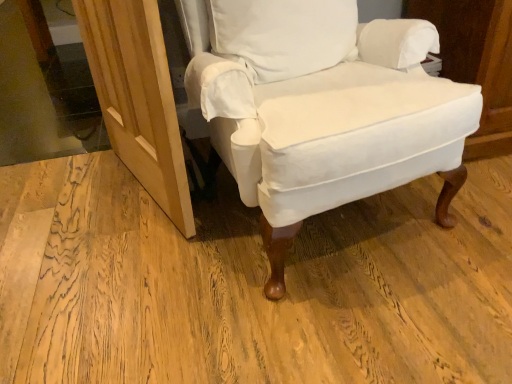
Question: Is transparent glass door at upper left facing towards white cotton chair at center?

Choices:
 (A) no
 (B) yes

Answer: (A)

Question: Is transparent glass door at upper left wider than white cotton chair at center?

Choices:
 (A) no
 (B) yes

Answer: (B)

Question: Is transparent glass door at upper left closer to camera compared to white cotton chair at center?

Choices:
 (A) no
 (B) yes

Answer: (A)

Question: Does transparent glass door at upper left lie behind white cotton chair at center?

Choices:
 (A) yes
 (B) no

Answer: (A)

Question: Does transparent glass door at upper left have a lesser height compared to white cotton chair at center?

Choices:
 (A) no
 (B) yes

Answer: (B)

Question: Is white cotton pillow at center wider or thinner than natural wood screen door at lower left?

Choices:
 (A) wide
 (B) thin

Answer: (A)

Question: Is white cotton pillow at center inside or outside of natural wood screen door at lower left?

Choices:
 (A) inside
 (B) outside

Answer: (B)

Question: In terms of height, does white cotton pillow at center look taller or shorter compared to natural wood screen door at lower left?

Choices:
 (A) short
 (B) tall

Answer: (A)

Question: From a real-world perspective, is white cotton pillow at center positioned above or below natural wood screen door at lower left?

Choices:
 (A) below
 (B) above

Answer: (B)

Question: From the image's perspective, is white cotton pillow at center positioned above or below transparent glass door at upper left?

Choices:
 (A) below
 (B) above

Answer: (A)

Question: Considering the positions of white cotton pillow at center and transparent glass door at upper left in the image, is white cotton pillow at center wider or thinner than transparent glass door at upper left?

Choices:
 (A) thin
 (B) wide

Answer: (A)

Question: Considering the relative positions of white cotton pillow at center and transparent glass door at upper left in the image provided, is white cotton pillow at center to the left or to the right of transparent glass door at upper left?

Choices:
 (A) right
 (B) left

Answer: (A)

Question: Considering the positions of point (249, 39) and point (33, 144), is point (249, 39) closer or farther from the camera than point (33, 144)?

Choices:
 (A) closer
 (B) farther

Answer: (A)

Question: In the image, is white cotton pillow at center on the left side or the right side of white cotton chair at center?

Choices:
 (A) right
 (B) left

Answer: (B)

Question: Based on their sizes in the image, would you say white cotton pillow at center is bigger or smaller than white cotton chair at center?

Choices:
 (A) big
 (B) small

Answer: (B)